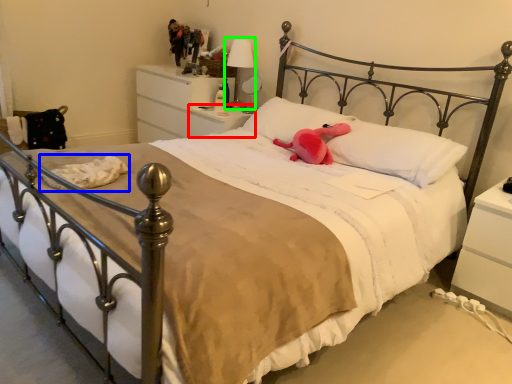
Question: Considering the real-world distances, which object is farthest from nightstand (highlighted by a red box)? material (highlighted by a blue box) or table lamp (highlighted by a green box)?

Choices:
 (A) material
 (B) table lamp

Answer: (A)